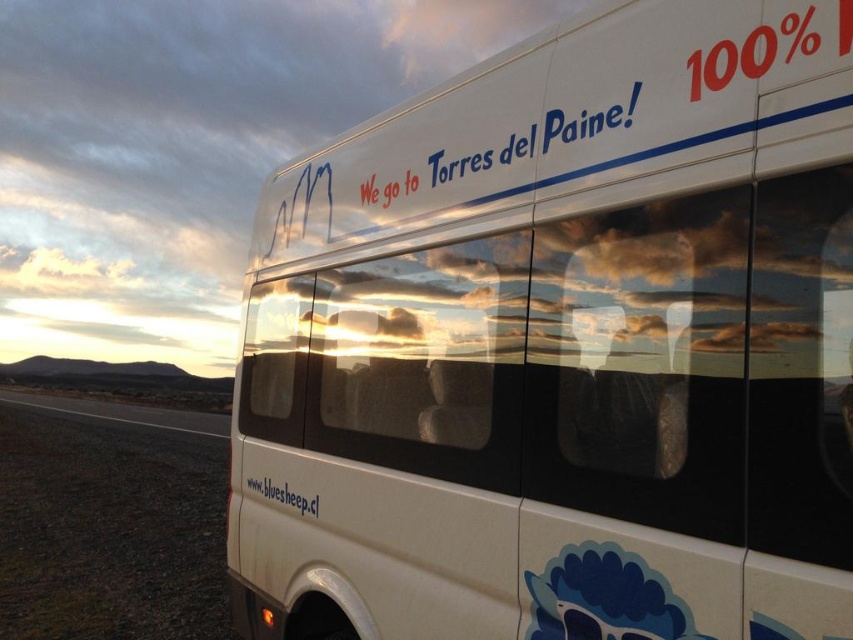
Question: Does white matte bus at center appear over white matte text at lower center?

Choices:
 (A) no
 (B) yes

Answer: (B)

Question: Which point is farther to the camera?

Choices:
 (A) white matte bus at center
 (B) white matte text at lower center

Answer: (B)

Question: Which object is farther from the camera taking this photo?

Choices:
 (A) white matte text at lower center
 (B) white matte bus at center

Answer: (A)

Question: Is the position of white matte bus at center less distant than that of white matte text at lower center?

Choices:
 (A) yes
 (B) no

Answer: (A)

Question: Can you confirm if white matte bus at center is positioned above white matte text at lower center?

Choices:
 (A) no
 (B) yes

Answer: (B)